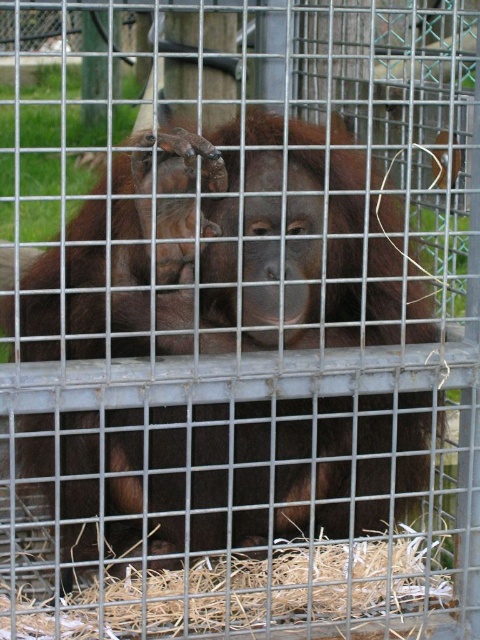
You are a zookeeper observing the orangutan in its cage. You need to determine if the straw at lower center can fully cover the brown furry orangutan at center. Based on their sizes, what is your conclusion?

The brown furry orangutan at center is wider than the straw at lower center, so the straw at lower center cannot fully cover the brown furry orangutan at center.

You are an animal caretaker standing at the entrance of the cage. You need to place a banana at the exact center of the cage. The brown furry orangutan at center is currently at position coordinates of 0.394 on the x axis and 0.477 on the y axis. Will the banana be placed directly in front of the orangutan?

The brown furry orangutan at center is located at coordinates 0.394 on the x axis and 0.477 on the y axis. The exact center of the cage would be at coordinates 0.5 on both axes. Since the orangutan is at 0.394 and 0.477, which are both less than 0.5, the banana placed at the center would be to the right and slightly above the orangutan, not directly in front of it.

You are a zookeeper observing the brown furry orangutan at center and the straw at lower center in its enclosure. Which object is taller?

The brown furry orangutan at center is taller than the straw at lower center.